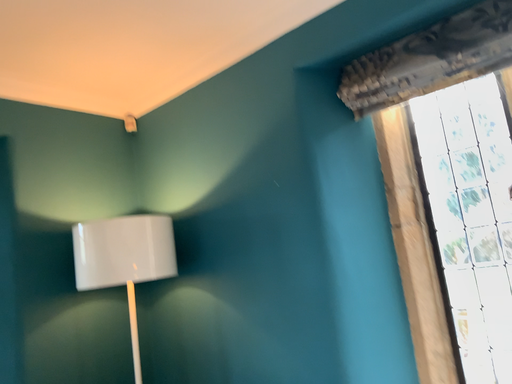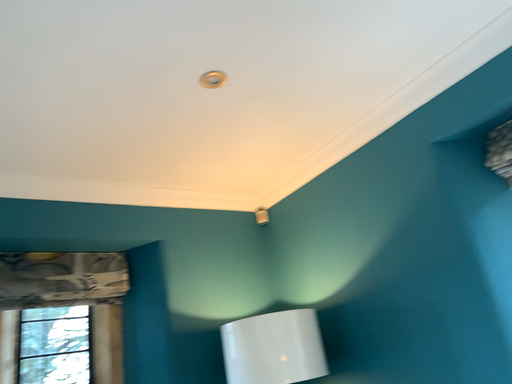
Question: How did the camera likely rotate when shooting the video?

Choices:
 (A) rotated downward
 (B) rotated upward

Answer: (B)